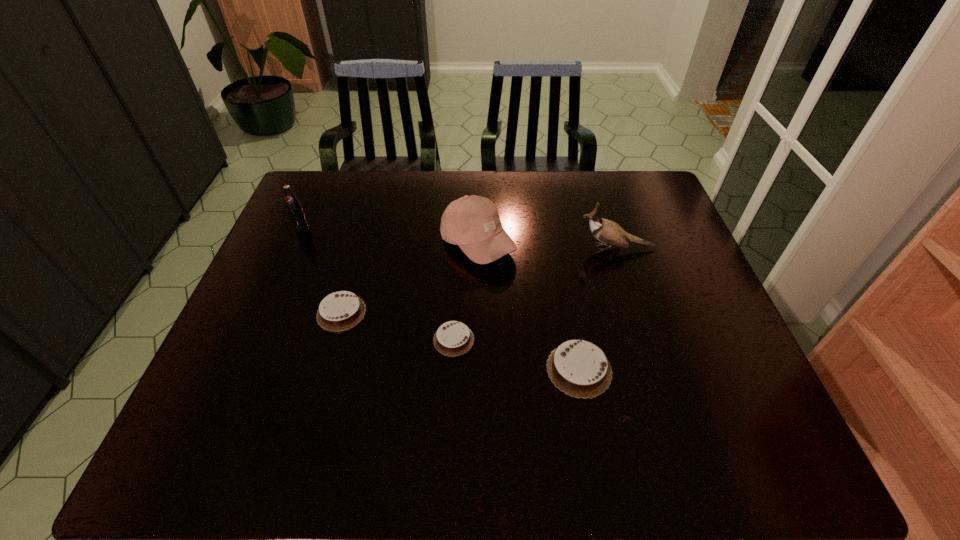
This screenshot has height=540, width=960. I want to click on free region located 0.300m on the right of the shortest object, so click(599, 340).

Locate an element on the screen. free space located on the left of the third shortest object is located at coordinates (410, 369).

The width and height of the screenshot is (960, 540). In order to click on vacant space positioned on the front-facing side of the baseball cap in this screenshot , I will do `click(635, 244)`.

The width and height of the screenshot is (960, 540). Find the location of `vacant area situated 0.130m at the face of the bird`. vacant area situated 0.130m at the face of the bird is located at coordinates (532, 248).

The height and width of the screenshot is (540, 960). Identify the location of free space located 0.400m at the face of the bird. (439, 248).

This screenshot has height=540, width=960. Identify the location of vacant space positioned 0.380m at the face of the bird. pos(446,248).

Find the location of a particular element. vacant area located 0.130m on the front label of the leftmost object is located at coordinates (286, 262).

This screenshot has height=540, width=960. Identify the location of object positioned at the near edge. (579, 368).

Identify the location of object at the left edge. pos(295,211).

Where is `object at the right edge`? object at the right edge is located at coordinates (606, 231).